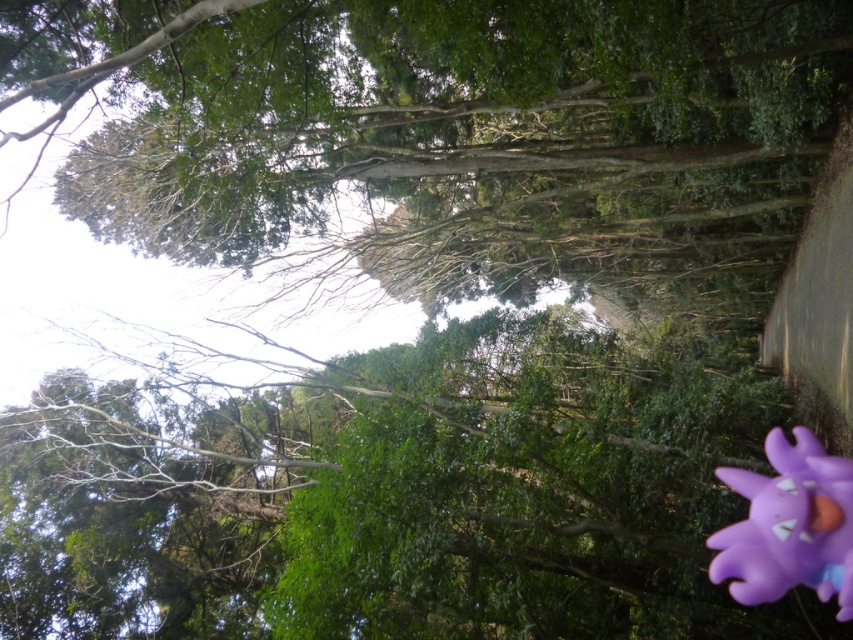
Question: Which of the following is the closest to the observer?

Choices:
 (A) (837, 564)
 (B) (804, 81)

Answer: (A)

Question: Does green leafy tree at center appear over purple matte toy at lower right?

Choices:
 (A) no
 (B) yes

Answer: (B)

Question: Which object is farther from the camera taking this photo?

Choices:
 (A) green leafy tree at center
 (B) purple matte toy at lower right

Answer: (B)

Question: Is green leafy tree at center thinner than purple matte toy at lower right?

Choices:
 (A) yes
 (B) no

Answer: (B)

Question: Does green leafy tree at center appear under purple matte toy at lower right?

Choices:
 (A) yes
 (B) no

Answer: (B)